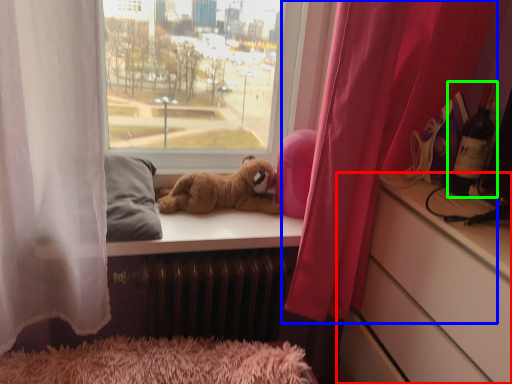
Question: Which is farther away from cabinetry (highlighted by a red box)? curtain (highlighted by a blue box) or wine bottle (highlighted by a green box)?

Choices:
 (A) curtain
 (B) wine bottle

Answer: (B)